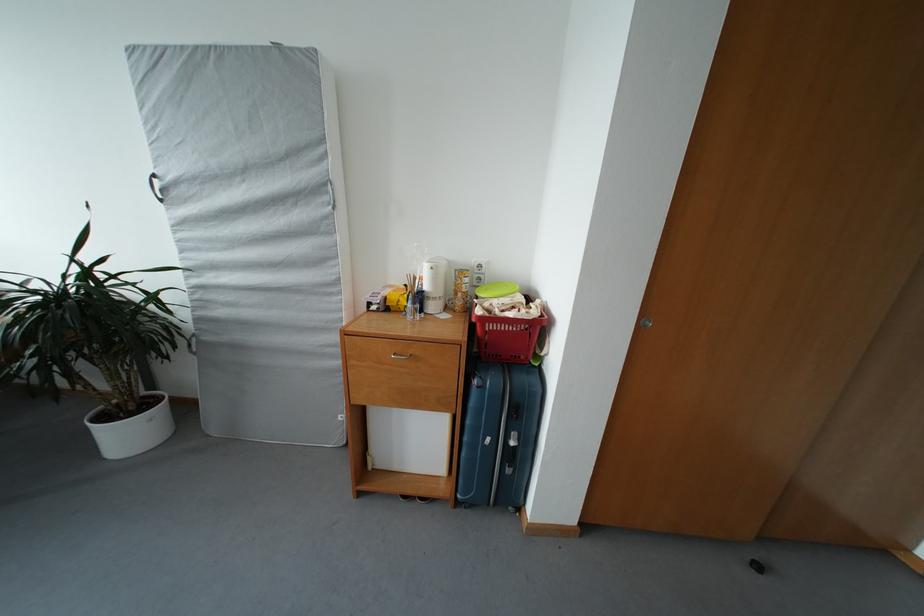
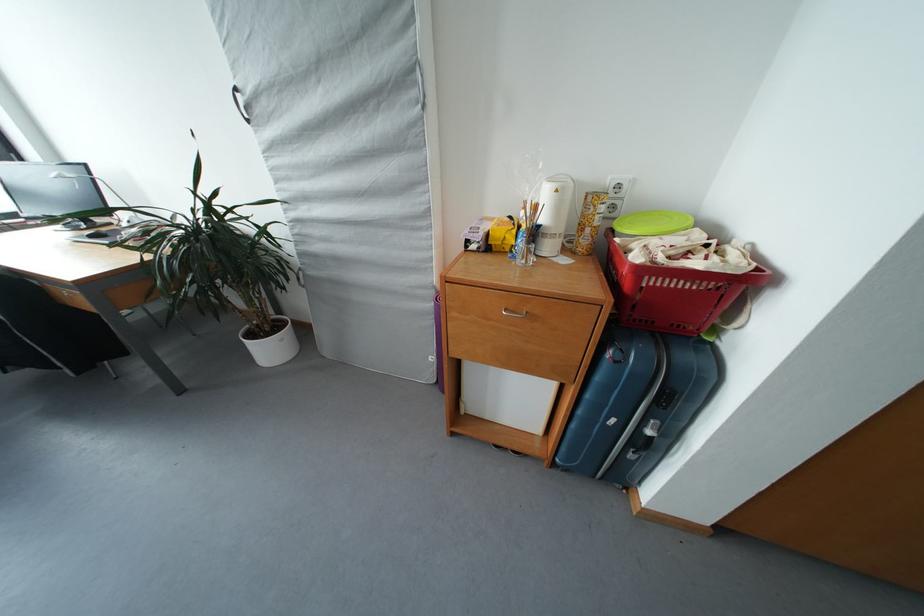
Find the pixel in the second image that matches the point at 469,459 in the first image.

(579, 431)